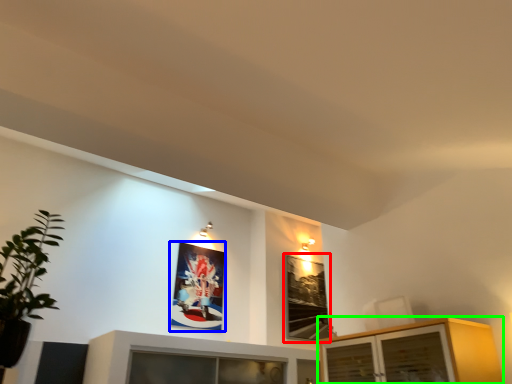
Question: Which object is positioned closest to picture frame (highlighted by a red box)? Select from picture frame (highlighted by a blue box) and cabinetry (highlighted by a green box).

Choices:
 (A) picture frame
 (B) cabinetry

Answer: (A)